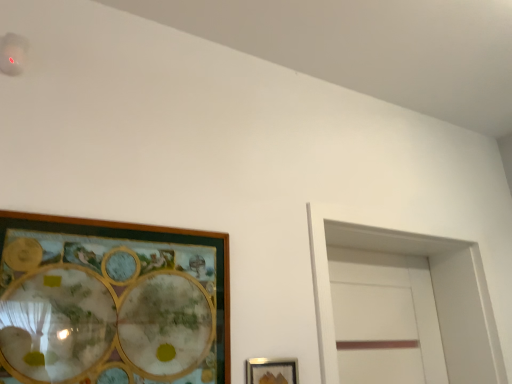
Question: Could wooden picture frame at left, the second picture frame when ordered from bottom to top, be considered to be inside white matte glass door at right?

Choices:
 (A) no
 (B) yes

Answer: (A)

Question: Is white matte glass door at right looking in the opposite direction of wooden picture frame at left, which is the first picture frame in left-to-right order?

Choices:
 (A) no
 (B) yes

Answer: (A)

Question: Considering the relative sizes of white matte glass door at right and wooden picture frame at left, marked as the second picture frame in a right-to-left arrangement, in the image provided, is white matte glass door at right shorter than wooden picture frame at left, marked as the second picture frame in a right-to-left arrangement,?

Choices:
 (A) yes
 (B) no

Answer: (B)

Question: Does white matte glass door at right have a smaller size compared to wooden picture frame at left, the second picture frame when ordered from bottom to top?

Choices:
 (A) yes
 (B) no

Answer: (B)

Question: Does white matte glass door at right come behind wooden picture frame at left, the second picture frame when ordered from bottom to top?

Choices:
 (A) yes
 (B) no

Answer: (A)

Question: Is white matte glass door at right taller or shorter than wooden picture frame at left, which is the first picture frame in top-to-bottom order?

Choices:
 (A) short
 (B) tall

Answer: (B)

Question: In the image, is white matte glass door at right on the left side or the right side of wooden picture frame at left, marked as the second picture frame in a right-to-left arrangement?

Choices:
 (A) left
 (B) right

Answer: (B)

Question: Which is correct: white matte glass door at right is inside wooden picture frame at left, marked as the second picture frame in a right-to-left arrangement, or outside of it?

Choices:
 (A) inside
 (B) outside

Answer: (B)

Question: In terms of size, does white matte glass door at right appear bigger or smaller than wooden picture frame at left, which is the first picture frame in top-to-bottom order?

Choices:
 (A) small
 (B) big

Answer: (B)

Question: Is white matte glass door at right to the left or to the right of metallic silver picture frame at lower center, the 2th picture frame from the top, in the image?

Choices:
 (A) left
 (B) right

Answer: (B)

Question: Would you say white matte glass door at right is inside or outside metallic silver picture frame at lower center, the first picture frame positioned from the right?

Choices:
 (A) outside
 (B) inside

Answer: (A)

Question: Considering the positions of white matte glass door at right and metallic silver picture frame at lower center, the first picture frame positioned from the right, in the image, is white matte glass door at right bigger or smaller than metallic silver picture frame at lower center, the first picture frame positioned from the right,?

Choices:
 (A) small
 (B) big

Answer: (B)

Question: In terms of width, does white matte glass door at right look wider or thinner when compared to metallic silver picture frame at lower center, the first picture frame ordered from the bottom?

Choices:
 (A) wide
 (B) thin

Answer: (A)

Question: From a real-world perspective, is metallic silver picture frame at lower center, the 2th picture frame from the top, physically located above or below white matte glass door at right?

Choices:
 (A) below
 (B) above

Answer: (A)

Question: In the image, is metallic silver picture frame at lower center, positioned as the second picture frame in left-to-right order, on the left side or the right side of white matte glass door at right?

Choices:
 (A) left
 (B) right

Answer: (A)